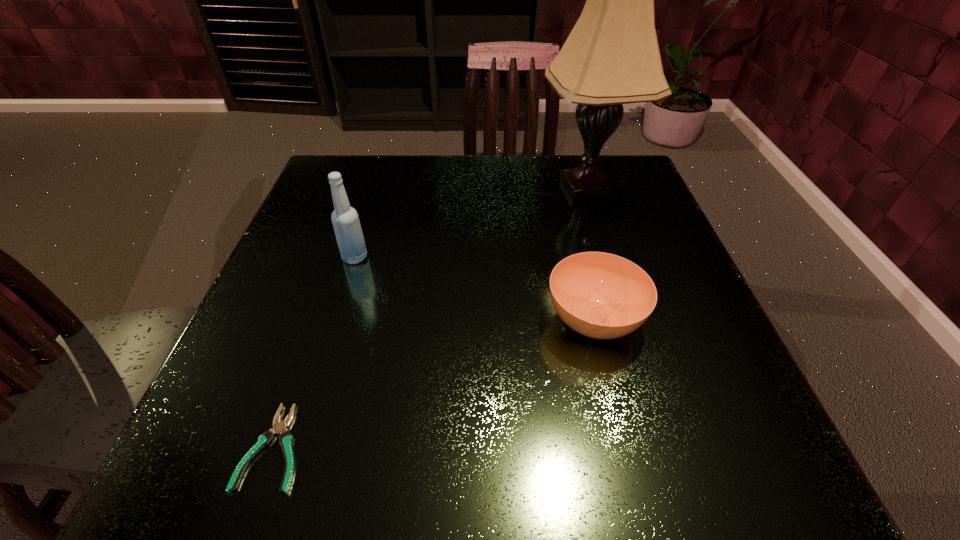
In the image, there is a desktop. Where is `free space at the far edge`? The height and width of the screenshot is (540, 960). free space at the far edge is located at coordinates tap(439, 172).

The width and height of the screenshot is (960, 540). In order to click on free space at the left edge of the desktop in this screenshot , I will do `click(323, 302)`.

You are a GUI agent. You are given a task and a screenshot of the screen. Output one action in this format:
    pyautogui.click(x=<x>, y=<y>)
    Task: Click on the free space at the right edge
    This screenshot has height=540, width=960.
    Given the screenshot: What is the action you would take?
    pyautogui.click(x=678, y=388)

Locate an element on the screen. The height and width of the screenshot is (540, 960). free region at the far left corner of the desktop is located at coordinates (361, 172).

In the image, there is a desktop. Where is `vacant area at the near right corner`? The image size is (960, 540). vacant area at the near right corner is located at coordinates (749, 476).

Find the location of a particular element. free point between the second nearest object and the second farthest object is located at coordinates (474, 288).

Where is `free space between the pliers and the soup bowl`? free space between the pliers and the soup bowl is located at coordinates (434, 383).

You are a GUI agent. You are given a task and a screenshot of the screen. Output one action in this format:
    pyautogui.click(x=<x>, y=<y>)
    Task: Click on the empty space that is in between the second nearest object and the pliers
    
    Given the screenshot: What is the action you would take?
    pyautogui.click(x=434, y=383)

You are a GUI agent. You are given a task and a screenshot of the screen. Output one action in this format:
    pyautogui.click(x=<x>, y=<y>)
    Task: Click on the vacant space that is in between the shortest object and the third nearest object
    
    Given the screenshot: What is the action you would take?
    pyautogui.click(x=315, y=352)

Find the location of `free point between the shortest object and the second shortest object`. free point between the shortest object and the second shortest object is located at coordinates (434, 383).